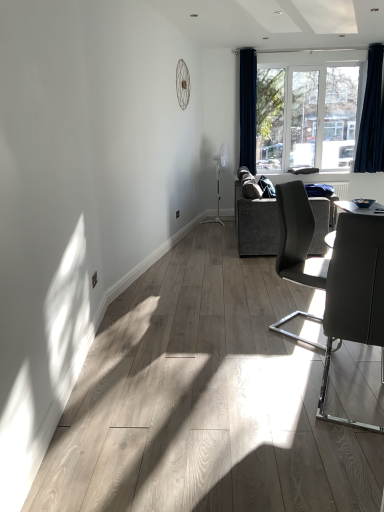
This screenshot has width=384, height=512. What do you see at coordinates (297, 238) in the screenshot?
I see `matte gray chair at center right, which is the first chair from back to front` at bounding box center [297, 238].

I want to click on navy blue velvet curtain at right, the 2th curtain positioned from the left, so click(x=370, y=110).

Where is `navy velvet curtain at upper center, which appears as the 1th curtain when viewed from the left`? The width and height of the screenshot is (384, 512). navy velvet curtain at upper center, which appears as the 1th curtain when viewed from the left is located at coordinates (248, 108).

What is the approximate width of dark gray fabric couch at center-right?

The width of dark gray fabric couch at center-right is 4.90 feet.

Locate an element on the screen. The height and width of the screenshot is (512, 384). dark gray fabric couch at center-right is located at coordinates (256, 225).

Locate an element on the screen. This screenshot has height=512, width=384. matte gray chair at right, the 1th chair in the front-to-back sequence is located at coordinates (354, 294).

This screenshot has width=384, height=512. What do you see at coordinates (315, 111) in the screenshot?
I see `clear glass window at upper center` at bounding box center [315, 111].

The image size is (384, 512). What are the coordinates of `clear glass window at upper center` in the screenshot? It's located at (315, 111).

Identify the location of matte gray chair at center right, which is the first chair from back to front. (297, 238).

Based on their sizes in the image, would you say matte gray chair at center right, which is the first chair from back to front, is bigger or smaller than matte gray chair at right, the 1th chair in the front-to-back sequence?

In the image, matte gray chair at center right, which is the first chair from back to front, appears to be larger than matte gray chair at right, the 1th chair in the front-to-back sequence.

Are matte gray chair at center right, which appears as the second chair when viewed from the front, and matte gray chair at right, the 1th chair in the front-to-back sequence, beside each other?

No, matte gray chair at center right, which appears as the second chair when viewed from the front, is not making contact with matte gray chair at right, the 1th chair in the front-to-back sequence.

From a real-world perspective, is matte gray chair at center right, which appears as the second chair when viewed from the front, above or below matte gray chair at right, the second chair when ordered from back to front?

Clearly, from a real-world perspective, matte gray chair at center right, which appears as the second chair when viewed from the front, is above matte gray chair at right, the second chair when ordered from back to front.

Considering the positions of point (261, 152) and point (240, 188), is point (261, 152) closer or farther from the camera than point (240, 188)?

Point (261, 152) is farther from the camera than point (240, 188).

Which is more to the right, clear glass window at upper center or dark gray fabric couch at center-right?

From the viewer's perspective, clear glass window at upper center appears more on the right side.

Is clear glass window at upper center turned away from dark gray fabric couch at center-right?

No.

How different are the orientations of clear glass window at upper center and dark gray fabric couch at center-right in degrees?

88.8 degrees separate the facing orientations of clear glass window at upper center and dark gray fabric couch at center-right.

Is clear glass window at upper center oriented away from navy blue velvet curtain at right, which is the first curtain from right to left?

No.

Which is behind, clear glass window at upper center or navy blue velvet curtain at right, which is the first curtain from right to left?

Positioned behind is clear glass window at upper center.

In the image, is clear glass window at upper center on the left side or the right side of navy blue velvet curtain at right, which is the first curtain from right to left?

clear glass window at upper center is positioned on navy blue velvet curtain at right, which is the first curtain from right to left,'s left side.

Which curtain is the 2nd one when counting from the front of the clear glass window at upper center? Please provide its 2D coordinates.

[(370, 110)]

Can you tell me how much navy blue velvet curtain at right, the 2th curtain positioned from the left, and clear glass window at upper center differ in facing direction?

There is a 0.00426-degree angle between the facing directions of navy blue velvet curtain at right, the 2th curtain positioned from the left, and clear glass window at upper center.

Considering the relative sizes of navy blue velvet curtain at right, the 2th curtain positioned from the left, and clear glass window at upper center in the image provided, is navy blue velvet curtain at right, the 2th curtain positioned from the left, shorter than clear glass window at upper center?

Incorrect, the height of navy blue velvet curtain at right, the 2th curtain positioned from the left, does not fall short of that of clear glass window at upper center.

From a real-world perspective, is navy blue velvet curtain at right, which is the first curtain from right to left, located higher than clear glass window at upper center?

Yes, from a real-world perspective, navy blue velvet curtain at right, which is the first curtain from right to left, is on top of clear glass window at upper center.

Can you confirm if navy blue velvet curtain at right, the 2th curtain positioned from the left, is thinner than clear glass window at upper center?

No, navy blue velvet curtain at right, the 2th curtain positioned from the left, is not thinner than clear glass window at upper center.

Would you consider navy blue velvet curtain at right, the 2th curtain positioned from the left, to be distant from matte gray chair at center right, which appears as the second chair when viewed from the front?

That's right, there is a large distance between navy blue velvet curtain at right, the 2th curtain positioned from the left, and matte gray chair at center right, which appears as the second chair when viewed from the front.

In the scene shown: Which is behind, navy blue velvet curtain at right, the 2th curtain positioned from the left, or matte gray chair at center right, which appears as the second chair when viewed from the front?

navy blue velvet curtain at right, the 2th curtain positioned from the left, is further away from the camera.

From the image's perspective, would you say navy blue velvet curtain at right, which is the first curtain from right to left, is positioned over matte gray chair at center right, which appears as the second chair when viewed from the front?

Correct, navy blue velvet curtain at right, which is the first curtain from right to left, appears higher than matte gray chair at center right, which appears as the second chair when viewed from the front, in the image.

Considering the relative positions of navy blue velvet curtain at right, the 2th curtain positioned from the left, and matte gray chair at center right, which appears as the second chair when viewed from the front, in the image provided, is navy blue velvet curtain at right, the 2th curtain positioned from the left, to the right of matte gray chair at center right, which appears as the second chair when viewed from the front, from the viewer's perspective?

Yes.

Is clear glass window at upper center taller or shorter than matte gray chair at center right, which is the first chair from back to front?

clear glass window at upper center is taller than matte gray chair at center right, which is the first chair from back to front.

In terms of size, does clear glass window at upper center appear bigger or smaller than matte gray chair at center right, which is the first chair from back to front?

Considering their sizes, clear glass window at upper center takes up less space than matte gray chair at center right, which is the first chair from back to front.

From a real-world perspective, who is located higher, clear glass window at upper center or matte gray chair at center right, which is the first chair from back to front?

From a 3D spatial view, clear glass window at upper center is above.

Is dark gray fabric couch at center-right wider than matte gray chair at right, the second chair when ordered from back to front?

Correct, the width of dark gray fabric couch at center-right exceeds that of matte gray chair at right, the second chair when ordered from back to front.

Considering their positions, is dark gray fabric couch at center-right located in front of or behind matte gray chair at right, the 1th chair in the front-to-back sequence?

dark gray fabric couch at center-right is behind matte gray chair at right, the 1th chair in the front-to-back sequence.

Is dark gray fabric couch at center-right oriented towards matte gray chair at right, the second chair when ordered from back to front?

No, dark gray fabric couch at center-right is not aimed at matte gray chair at right, the second chair when ordered from back to front.

This screenshot has width=384, height=512. Find the location of `chair below the matte gray chair at center right, which appears as the second chair when viewed from the front (from the image's perspective)`. chair below the matte gray chair at center right, which appears as the second chair when viewed from the front (from the image's perspective) is located at coordinates (354, 294).

What are the coordinates of `window to the right of dark gray fabric couch at center-right` in the screenshot? It's located at (315, 111).

Based on their spatial positions, is dark gray fabric couch at center-right or navy blue velvet curtain at right, which is the first curtain from right to left, closer to matte gray chair at right, the 1th chair in the front-to-back sequence?

Based on the image, dark gray fabric couch at center-right appears to be nearer to matte gray chair at right, the 1th chair in the front-to-back sequence.

Looking at the image, which one is located closer to navy blue velvet curtain at right, which is the first curtain from right to left, matte gray chair at center right, which is the first chair from back to front, or navy velvet curtain at upper center, which appears as the 1th curtain when viewed from the left?

Based on the image, navy velvet curtain at upper center, which appears as the 1th curtain when viewed from the left, appears to be nearer to navy blue velvet curtain at right, which is the first curtain from right to left.

Looking at the image, which one is located closer to matte gray chair at right, the second chair when ordered from back to front, navy velvet curtain at upper center, which appears as the 1th curtain when viewed from the left, or matte gray chair at center right, which appears as the second chair when viewed from the front?

matte gray chair at center right, which appears as the second chair when viewed from the front, is closer to matte gray chair at right, the second chair when ordered from back to front.

When comparing their distances from matte gray chair at center right, which is the first chair from back to front, does navy velvet curtain at upper center, which appears as the 1th curtain when viewed from the left, or dark gray fabric couch at center-right seem closer?

dark gray fabric couch at center-right.

When comparing their distances from dark gray fabric couch at center-right, does clear glass window at upper center or navy blue velvet curtain at right, which is the first curtain from right to left, seem closer?

clear glass window at upper center is positioned closer to the anchor dark gray fabric couch at center-right.

When comparing their distances from matte gray chair at center right, which is the first chair from back to front, does matte gray chair at right, the 1th chair in the front-to-back sequence, or clear glass window at upper center seem closer?

matte gray chair at right, the 1th chair in the front-to-back sequence, lies closer to matte gray chair at center right, which is the first chair from back to front, than the other object.

When comparing their distances from matte gray chair at right, the 1th chair in the front-to-back sequence, does navy blue velvet curtain at right, the 2th curtain positioned from the left, or navy velvet curtain at upper center, the second curtain viewed from the right, seem further?

navy velvet curtain at upper center, the second curtain viewed from the right, lies further to matte gray chair at right, the 1th chair in the front-to-back sequence, than the other object.

Considering their positions, is matte gray chair at right, the 1th chair in the front-to-back sequence, positioned closer to navy blue velvet curtain at right, the 2th curtain positioned from the left, than matte gray chair at center right, which appears as the second chair when viewed from the front?

matte gray chair at center right, which appears as the second chair when viewed from the front.

In order to click on studio couch located between matte gray chair at center right, which is the first chair from back to front, and clear glass window at upper center in the depth direction in this screenshot , I will do `click(256, 225)`.

Locate an element on the screen. The width and height of the screenshot is (384, 512). studio couch positioned between matte gray chair at right, the second chair when ordered from back to front, and clear glass window at upper center from near to far is located at coordinates pyautogui.click(x=256, y=225).

This screenshot has width=384, height=512. In order to click on studio couch located between matte gray chair at center right, which appears as the second chair when viewed from the front, and navy blue velvet curtain at right, which is the first curtain from right to left, in the depth direction in this screenshot , I will do (x=256, y=225).

Locate an element on the screen. This screenshot has height=512, width=384. chair between matte gray chair at right, the 1th chair in the front-to-back sequence, and clear glass window at upper center from front to back is located at coordinates (297, 238).